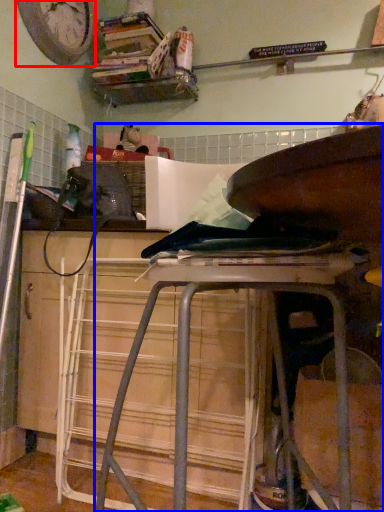
Question: Which of the following is the closest to the observer, clock (highlighted by a red box) or furniture (highlighted by a blue box)?

Choices:
 (A) clock
 (B) furniture

Answer: (B)